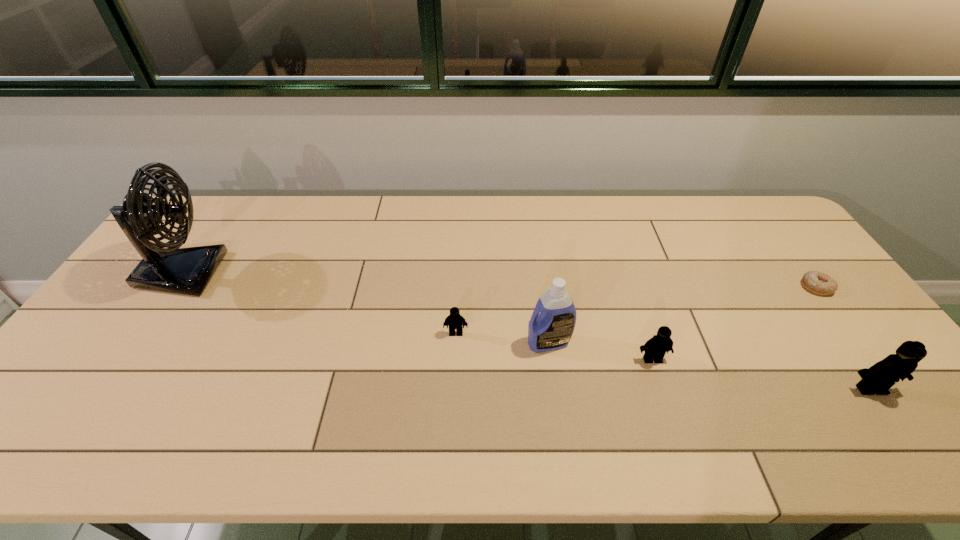
Identify the location of vacant point that satisfies the following two spatial constraints: 1. on the face of the shortest Lego; 2. on the left side of the fifth shortest object. The image size is (960, 540). (455, 343).

Image resolution: width=960 pixels, height=540 pixels. In order to click on free point that satisfies the following two spatial constraints: 1. on the back side of the fifth shortest object; 2. on the right side of the doughnut in this screenshot , I will do `click(541, 287)`.

The width and height of the screenshot is (960, 540). Find the location of `free point that satisfies the following two spatial constraints: 1. in front of the tallest object to blow air; 2. on the left side of the fifth shortest object`. free point that satisfies the following two spatial constraints: 1. in front of the tallest object to blow air; 2. on the left side of the fifth shortest object is located at coordinates (135, 343).

What are the coordinates of `free point that satisfies the following two spatial constraints: 1. on the face of the second tallest object; 2. on the right side of the farthest Lego` in the screenshot? It's located at (455, 343).

At what (x,y) coordinates should I click in order to perform the action: click on free location that satisfies the following two spatial constraints: 1. on the face of the farthest Lego; 2. on the right side of the third object from left to right. Please return your answer as a coordinate pair (x, y). The image size is (960, 540). Looking at the image, I should click on (455, 343).